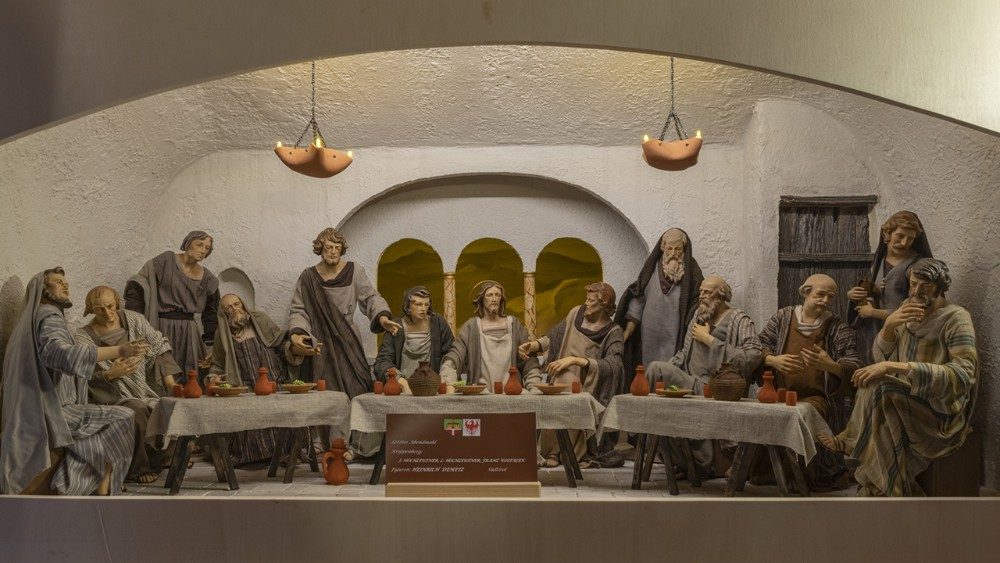
Where is `lights`? Image resolution: width=1000 pixels, height=563 pixels. lights is located at coordinates (315, 140), (343, 155), (279, 141), (644, 137), (696, 132).